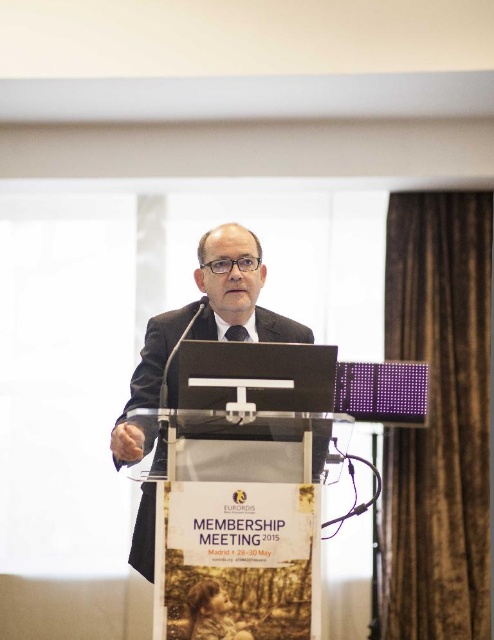
You are an event planner trying to place a name tag on the podium for the speaker. The name tag must be placed exactly at the coordinates point (203, 326). Based on the scene description, where will the name tag be placed?

The point (203, 326) is on the matte black suit at center, so the name tag will be placed on the speaker wearing the matte black suit at center.

You are a photographer at the event and need to ensure that both the matte black suit at center and the black textured tie at center are clearly visible in your photo. Which object should you focus on to capture both details without needing to adjust the camera focus afterward?

You should focus on the matte black suit at center because it is wider than the black textured tie at center, ensuring both are in focus when using a single focal point.